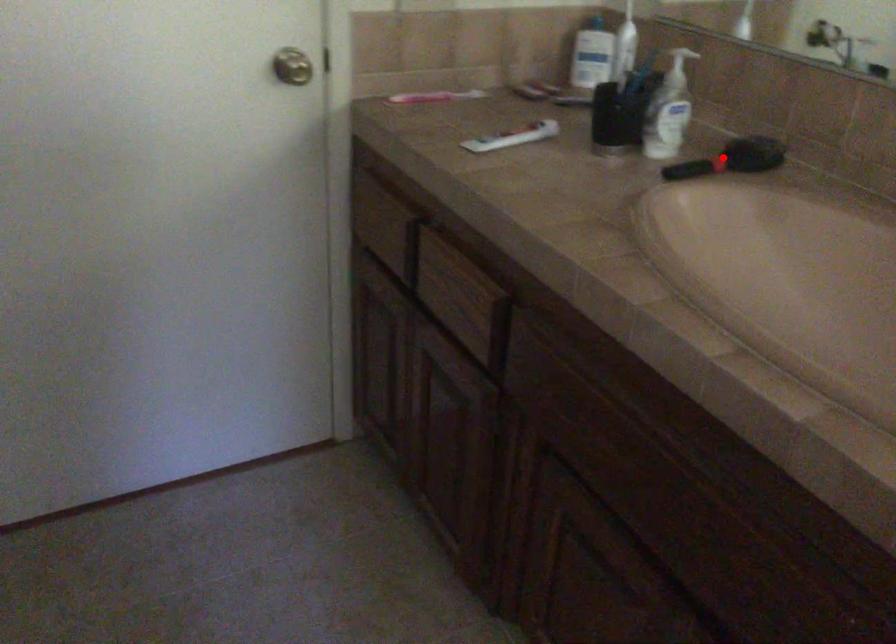
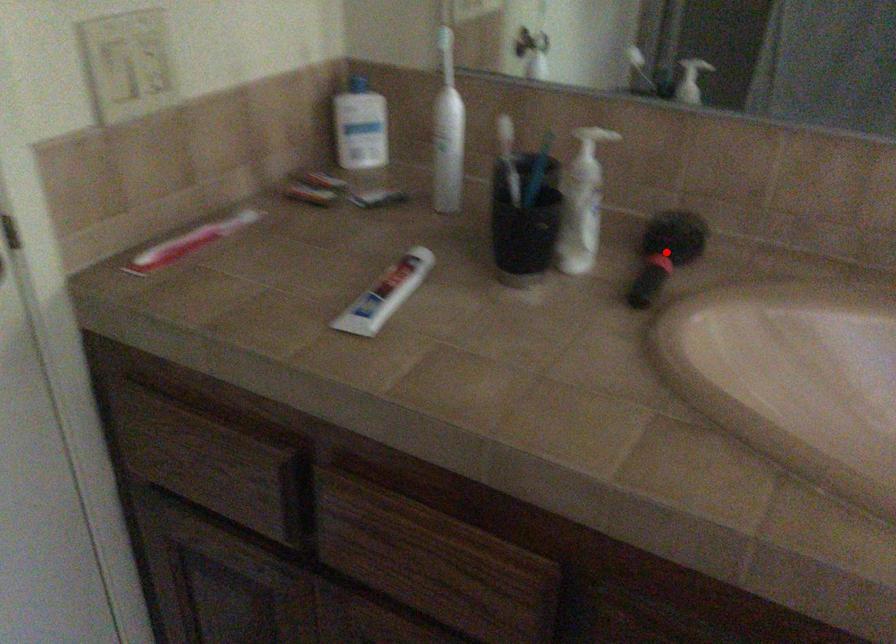
I am providing you with two images of the same scene from different viewpoints. A red point is marked on the first image and another point is marked on the second image. Is the red point in image1 aligned with the point shown in image2?

Yes